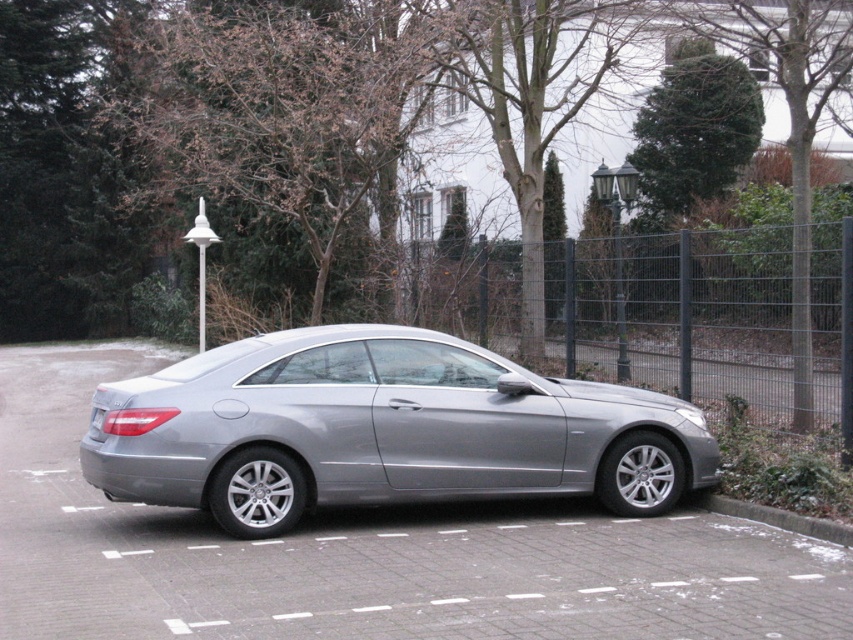
Question: Is gray concrete curb at lower right behind gray metallic license plate at center?

Choices:
 (A) no
 (B) yes

Answer: (A)

Question: Is the position of gray concrete curb at lower right more distant than that of gray metallic license plate at center?

Choices:
 (A) no
 (B) yes

Answer: (A)

Question: Considering the relative positions of satin silver car at center and gray concrete curb at lower right in the image provided, where is satin silver car at center located with respect to gray concrete curb at lower right?

Choices:
 (A) right
 (B) left

Answer: (B)

Question: Which object is closer to the camera taking this photo?

Choices:
 (A) green textured bush at upper right
 (B) gray metallic license plate at center
 (C) metallic wire mesh fence at center
 (D) satin silver car at center

Answer: (D)

Question: Which point is closer to the camera?

Choices:
 (A) (730, 513)
 (B) (651, 100)
 (C) (634, 480)

Answer: (C)

Question: Considering the real-world distances, which object is closest to the gray metallic license plate at center?

Choices:
 (A) gray concrete curb at lower right
 (B) satin silver car at center
 (C) green textured bush at upper right
 (D) metallic wire mesh fence at center

Answer: (B)